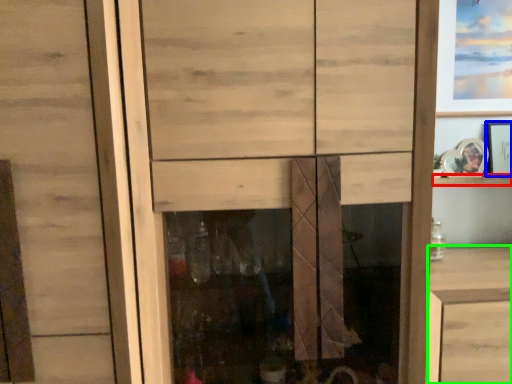
Question: Based on their relative distances, which object is nearer to shelf (highlighted by a red box)? Choose from picture frame (highlighted by a blue box) and vanity (highlighted by a green box).

Choices:
 (A) picture frame
 (B) vanity

Answer: (A)